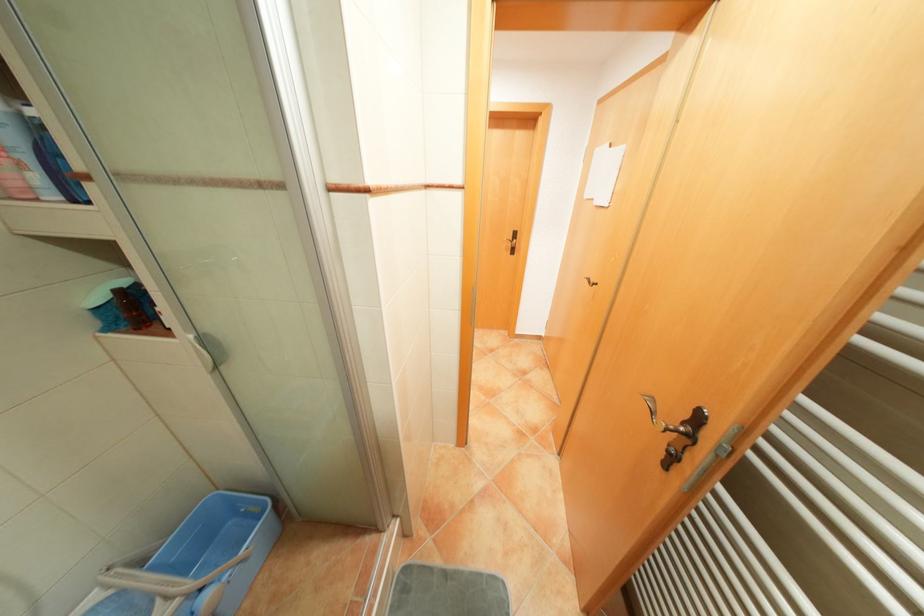
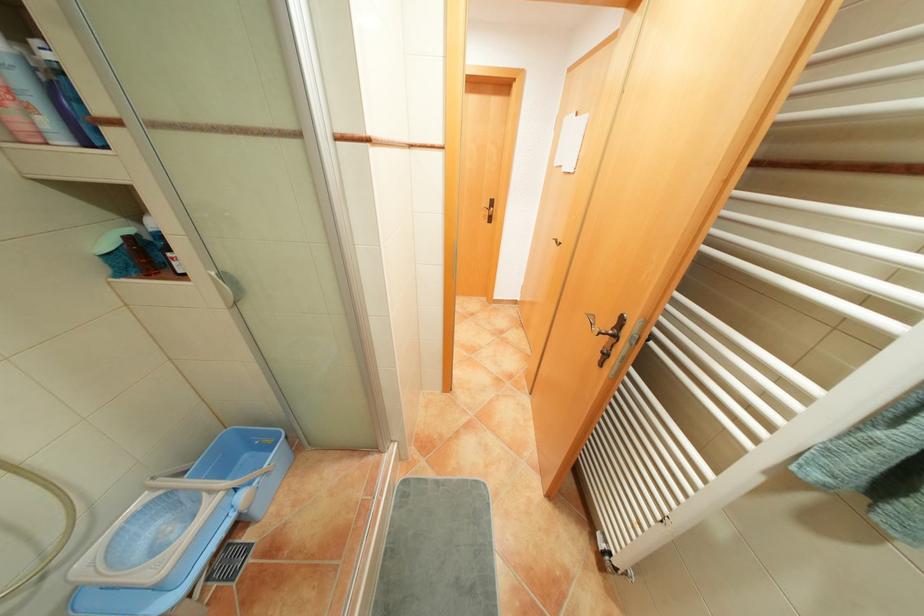
Where in the second image is the point corresponding to point 134,323 from the first image?

(144, 270)